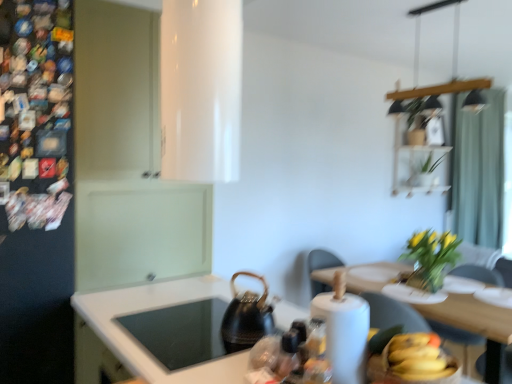
Question: Is wooden dining table at lower right at the back of white paper towel at lower right?

Choices:
 (A) no
 (B) yes

Answer: (A)

Question: Does white paper towel at lower right appear on the right side of wooden dining table at lower right?

Choices:
 (A) yes
 (B) no

Answer: (B)

Question: Does white paper towel at lower right have a greater width compared to wooden dining table at lower right?

Choices:
 (A) no
 (B) yes

Answer: (A)

Question: Is there a large distance between white paper towel at lower right and wooden dining table at lower right?

Choices:
 (A) yes
 (B) no

Answer: (A)

Question: Is white paper towel at lower right behind wooden dining table at lower right?

Choices:
 (A) no
 (B) yes

Answer: (A)

Question: Is point (442, 246) positioned closer to the camera than point (462, 342)?

Choices:
 (A) farther
 (B) closer

Answer: (A)

Question: From a real-world perspective, relative to light brown wooden chair at right, is yellow-green leaves at upper right, which is counted as the second plant, starting from the top, vertically above or below?

Choices:
 (A) above
 (B) below

Answer: (A)

Question: Considering the positions of yellow-green leaves at upper right, acting as the 1th plant starting from the bottom, and light brown wooden chair at right in the image, is yellow-green leaves at upper right, acting as the 1th plant starting from the bottom, wider or thinner than light brown wooden chair at right?

Choices:
 (A) wide
 (B) thin

Answer: (A)

Question: From the image's perspective, relative to light brown wooden chair at right, is yellow-green leaves at upper right, arranged as the second plant when viewed from the right, above or below?

Choices:
 (A) below
 (B) above

Answer: (B)

Question: Do you think light brown wooden chair at right is within yellow matte bananas at lower right, or outside of it?

Choices:
 (A) outside
 (B) inside

Answer: (A)

Question: Is light brown wooden chair at right taller or shorter than yellow matte bananas at lower right?

Choices:
 (A) short
 (B) tall

Answer: (B)

Question: Relative to yellow matte bananas at lower right, is light brown wooden chair at right in front or behind?

Choices:
 (A) behind
 (B) front

Answer: (A)

Question: Looking at the image, does light brown wooden chair at right seem bigger or smaller compared to yellow matte bananas at lower right?

Choices:
 (A) small
 (B) big

Answer: (B)

Question: Visually, is yellow matte bananas at lower right positioned to the left or to the right of yellow-green leaves at upper right, which is counted as the second plant, starting from the top?

Choices:
 (A) right
 (B) left

Answer: (B)

Question: Relative to yellow-green leaves at upper right, arranged as the 1th plant when viewed from the left, is yellow matte bananas at lower right in front or behind?

Choices:
 (A) front
 (B) behind

Answer: (A)